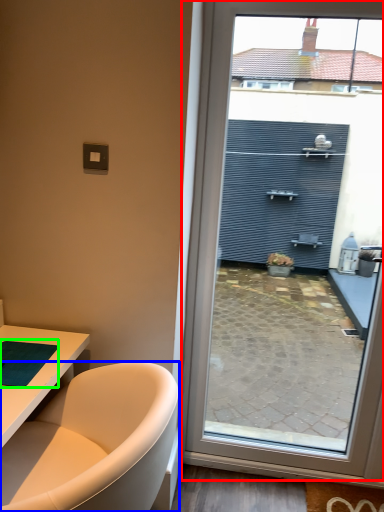
Question: Which object is positioned closest to window (highlighted by a red box)? Select from bathtub (highlighted by a blue box) and yoga mat (highlighted by a green box).

Choices:
 (A) bathtub
 (B) yoga mat

Answer: (A)